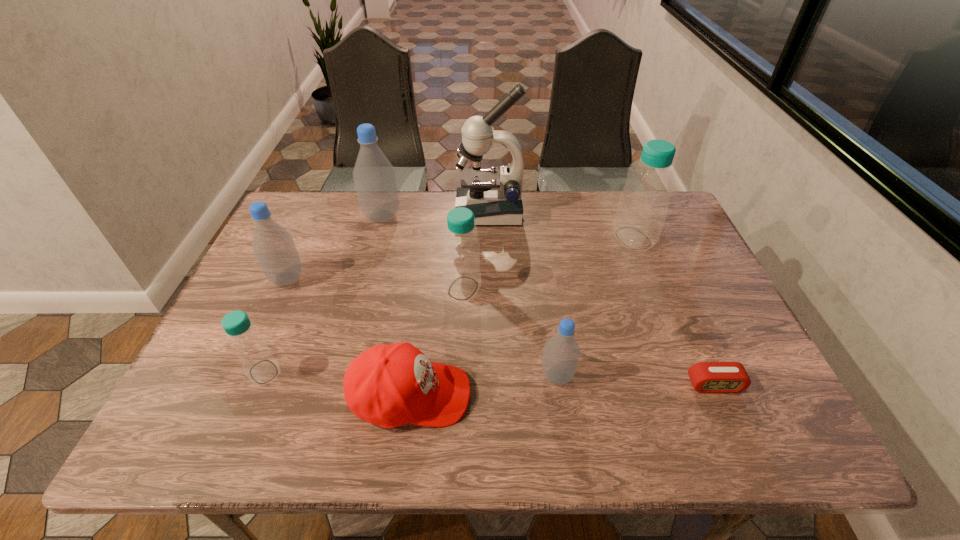
Where is `gray bottle identified as the closest to the second shortest object`? gray bottle identified as the closest to the second shortest object is located at coordinates (561, 354).

Identify the location of blue bottle that is the closest to the smallest blue bottle. This screenshot has width=960, height=540. (461, 247).

Locate which blue bottle ranks in proximity to the fourth bottle from right to left. Please provide its 2D coordinates. Your answer should be formatted as a tuple, i.e. [(x, y)], where the tuple contains the x and y coordinates of a point satisfying the conditions above.

[(461, 247)]

Identify the location of vacant area in the image that satisfies the following two spatial constraints: 1. at the eyepiece of the microscope; 2. on the front side of the third bottle from left to right. (490, 216).

What are the coordinates of `vacant position in the image that satisfies the following two spatial constraints: 1. on the front side of the second biggest gray bottle; 2. on the left side of the leftmost blue bottle` in the screenshot? It's located at (245, 372).

This screenshot has height=540, width=960. I want to click on vacant point that satisfies the following two spatial constraints: 1. at the eyepiece of the rightmost gray bottle; 2. on the right side of the tallest object, so click(x=493, y=376).